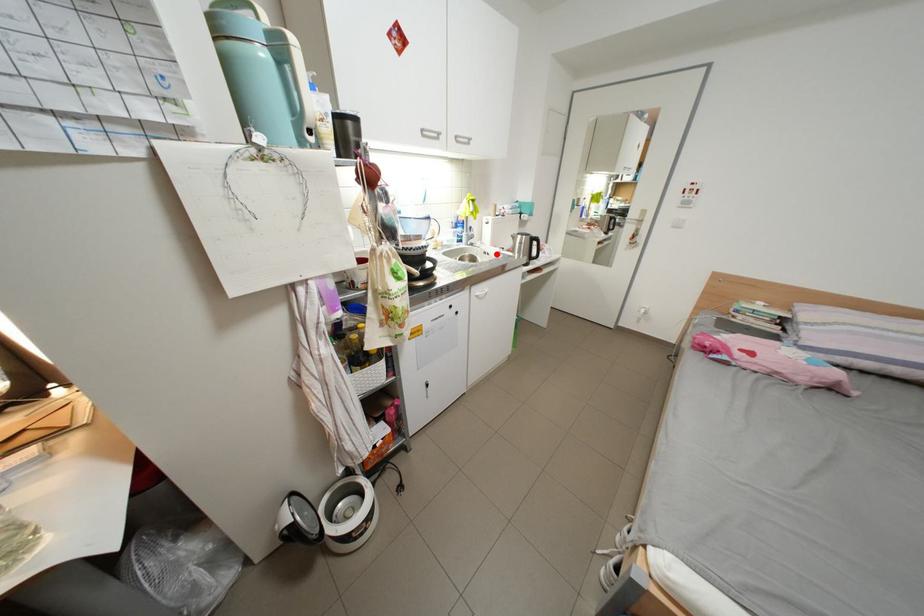
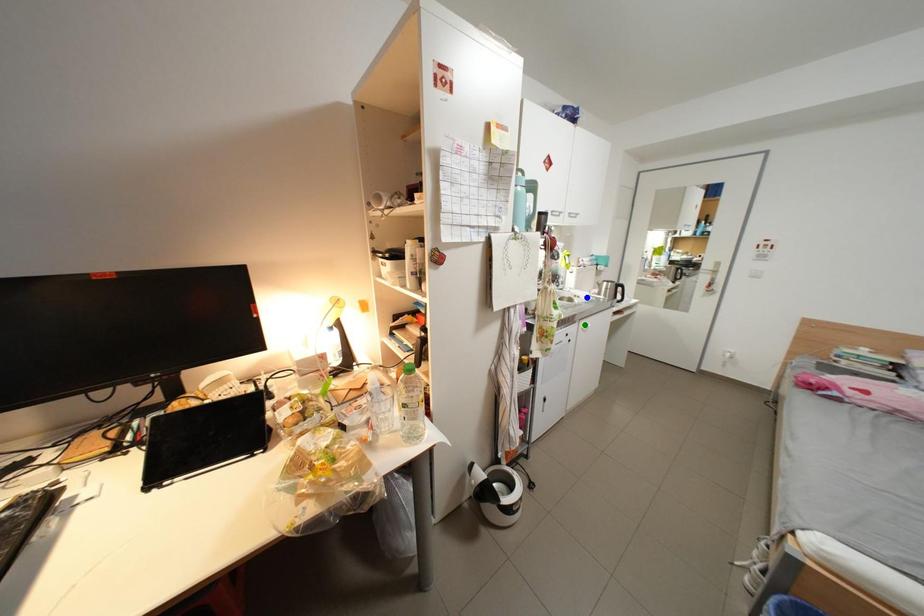
Question: I am providing you with two images of the same scene from different viewpoints. A red point is marked on the first image. You are given multiple points on the second image. In image 2, which mark is for the same physical point as the one in image 1?

Choices:
 (A) yellow point
 (B) green point
 (C) blue point

Answer: (C)